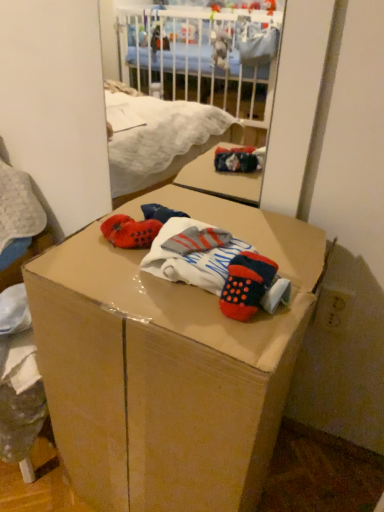
Question: Can you confirm if cardboard box at center is bigger than knitted wool socks at center?

Choices:
 (A) yes
 (B) no

Answer: (A)

Question: Is the depth of cardboard box at center less than that of knitted wool socks at center?

Choices:
 (A) no
 (B) yes

Answer: (B)

Question: Considering the relative sizes of cardboard box at center and knitted wool socks at center in the image provided, is cardboard box at center thinner than knitted wool socks at center?

Choices:
 (A) no
 (B) yes

Answer: (A)

Question: Is cardboard box at center facing away from knitted wool socks at center?

Choices:
 (A) yes
 (B) no

Answer: (B)

Question: Would you say cardboard box at center is outside knitted wool socks at center?

Choices:
 (A) no
 (B) yes

Answer: (B)

Question: From the image's perspective, is cardboard box at center located above knitted wool socks at center?

Choices:
 (A) no
 (B) yes

Answer: (A)

Question: Would you say cardboard box at center is part of knitted wool socks at center's contents?

Choices:
 (A) yes
 (B) no

Answer: (B)

Question: Can you confirm if knitted wool socks at center is thinner than cardboard box at center?

Choices:
 (A) yes
 (B) no

Answer: (A)

Question: Is knitted wool socks at center not inside cardboard box at center?

Choices:
 (A) no
 (B) yes

Answer: (A)

Question: Is knitted wool socks at center facing away from cardboard box at center?

Choices:
 (A) no
 (B) yes

Answer: (A)

Question: Considering the relative sizes of knitted wool socks at center and cardboard box at center in the image provided, is knitted wool socks at center shorter than cardboard box at center?

Choices:
 (A) yes
 (B) no

Answer: (A)

Question: Is knitted wool socks at center at the left side of cardboard box at center?

Choices:
 (A) no
 (B) yes

Answer: (A)

Question: From the image's perspective, is cardboard box at center above or below knitted wool socks at center?

Choices:
 (A) above
 (B) below

Answer: (B)